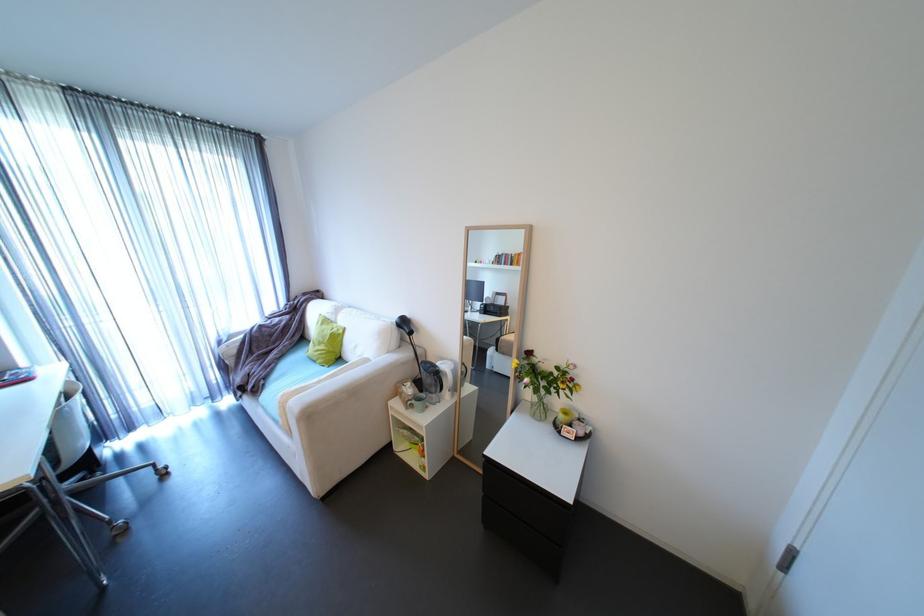
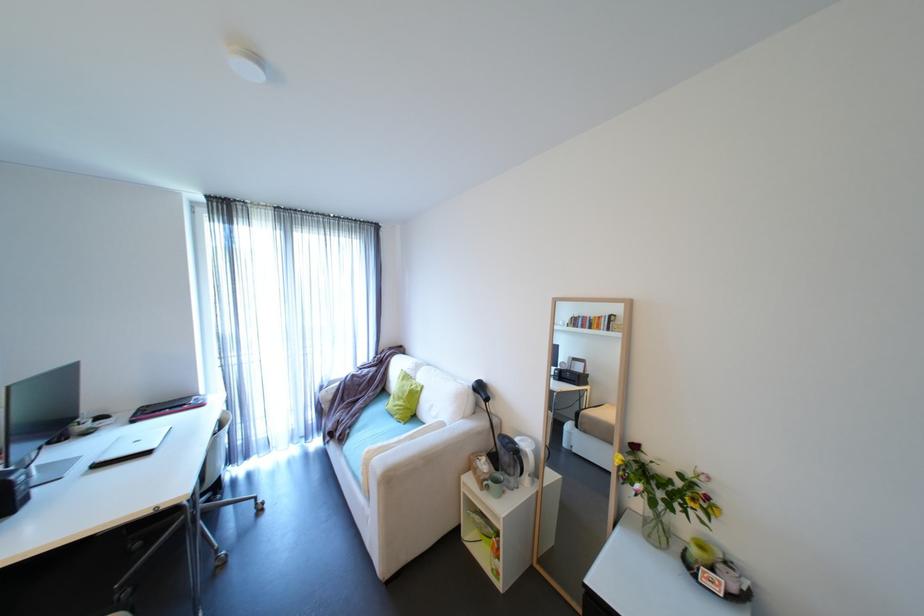
Locate, in the second image, the point that corresponds to (374,361) in the first image.

(450, 424)